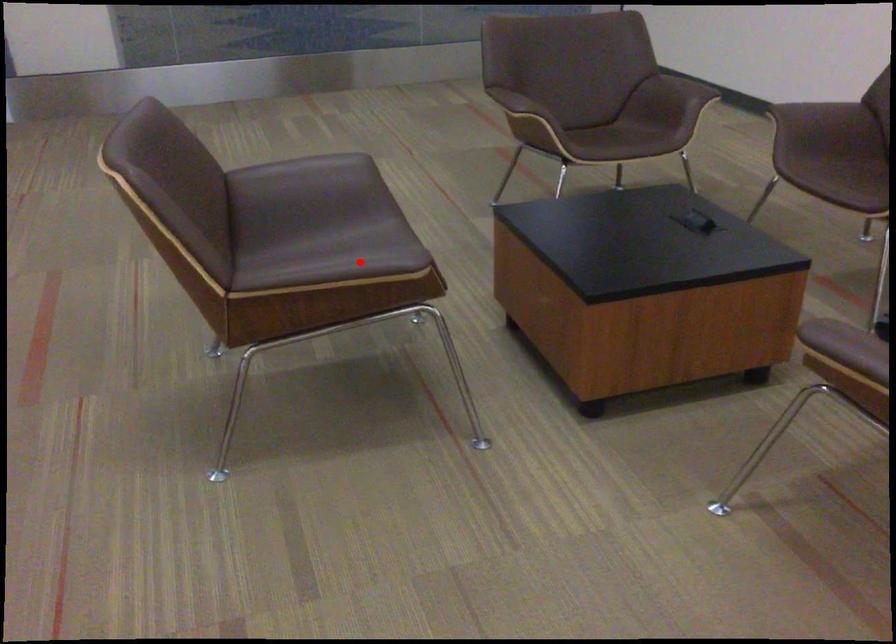
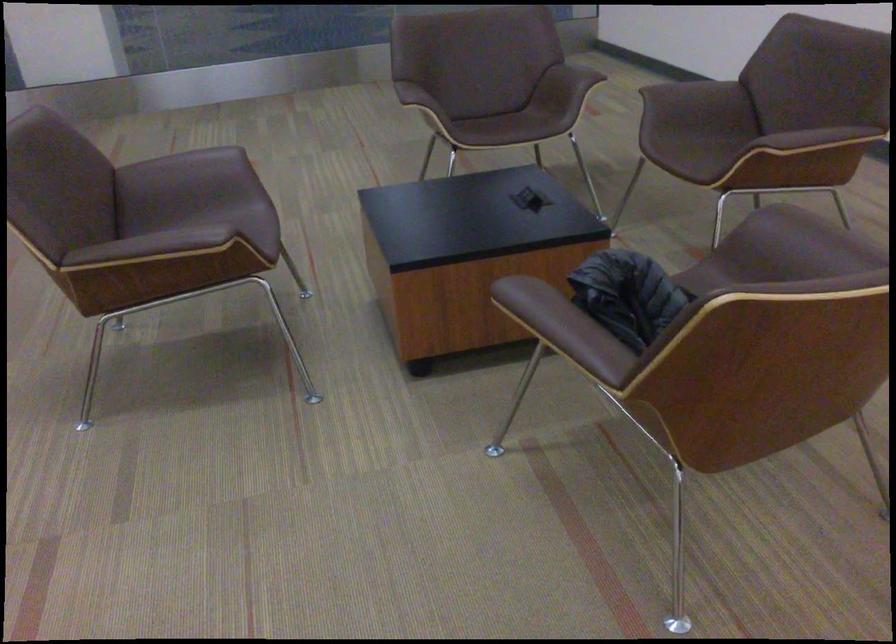
Find the pixel in the second image that matches the highlighted location in the first image.

(174, 242)